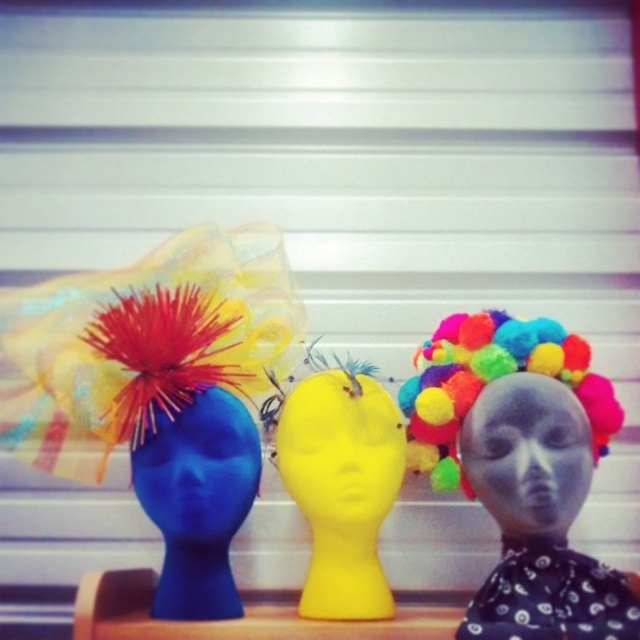
Question: In this image, where is matte gray mask at center located relative to blue matte head at center?

Choices:
 (A) above
 (B) below

Answer: (A)

Question: Which of the following is the farthest from the observer?

Choices:
 (A) multicolored fabric wig at center
 (B) blue matte head at center

Answer: (B)

Question: Can you confirm if matte gray mask at center is positioned above wooden at center?

Choices:
 (A) no
 (B) yes

Answer: (B)

Question: Is multicolored fabric wig at center smaller than matte gray mask at center?

Choices:
 (A) yes
 (B) no

Answer: (B)

Question: Which object appears farthest from the camera in this image?

Choices:
 (A) wooden at center
 (B) blue matte head at center
 (C) matte gray mask at center
 (D) yellow matte head at center

Answer: (D)

Question: Estimate the real-world distances between objects in this image. Which object is closer to the wooden at center?

Choices:
 (A) yellow matte head at center
 (B) matte gray mask at center

Answer: (A)